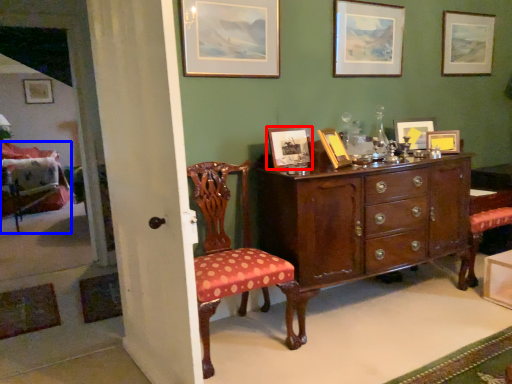
Question: Among these objects, which one is farthest to the camera, picture frame (highlighted by a red box) or chair (highlighted by a blue box)?

Choices:
 (A) picture frame
 (B) chair

Answer: (B)